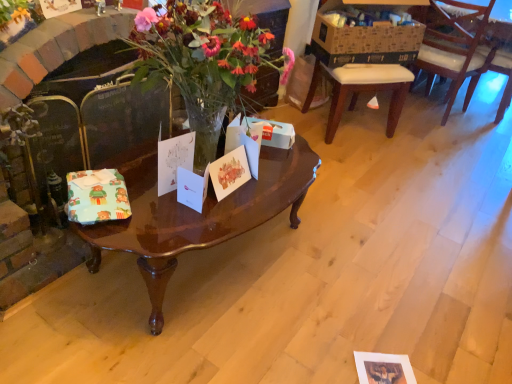
Locate an element on the screen. The width and height of the screenshot is (512, 384). spots to the right of brightly colored paper at center, which is the 1th gift card in left-to-right order is located at coordinates (150, 216).